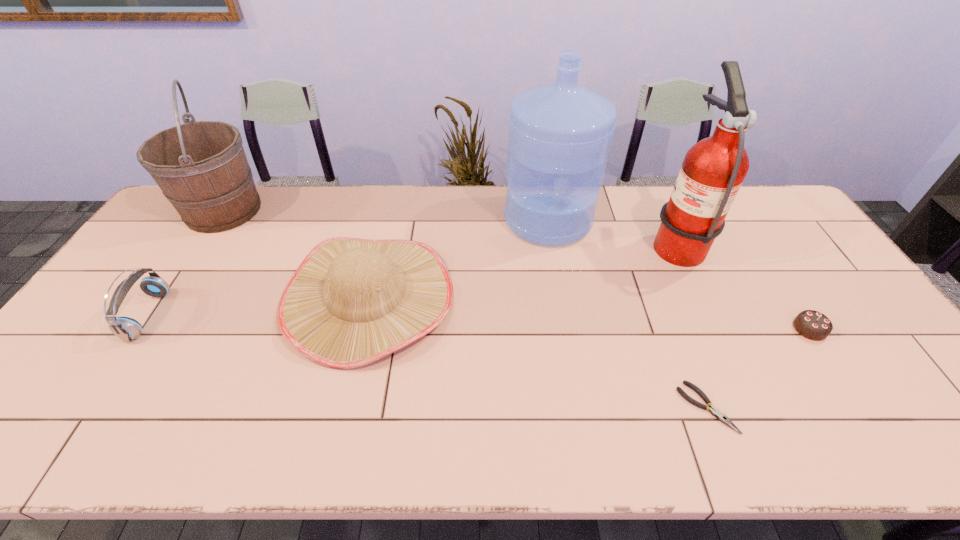
At what (x,y) coordinates should I click in order to perform the action: click on object that is the third closest to the fourth object from right to left. Please return your answer as a coordinate pair (x, y). Looking at the image, I should click on (719, 415).

Find the location of a particular element. free space that satisfies the following two spatial constraints: 1. on the side of the fourth object from left to right with the handle; 2. on the ear cups of the third shortest object is located at coordinates (564, 315).

The width and height of the screenshot is (960, 540). I want to click on free point that satisfies the following two spatial constraints: 1. on the back side of the sixth tallest object; 2. on the left side of the pliers, so click(x=676, y=329).

Where is `free space that satisfies the following two spatial constraints: 1. on the ear cups of the fifth tallest object; 2. on the back side of the shortest object`? free space that satisfies the following two spatial constraints: 1. on the ear cups of the fifth tallest object; 2. on the back side of the shortest object is located at coordinates (86, 407).

At what (x,y) coordinates should I click in order to perform the action: click on free spot that satisfies the following two spatial constraints: 1. on the front side of the sunhat; 2. on the left side of the fifth shortest object. Please return your answer as a coordinate pair (x, y). The height and width of the screenshot is (540, 960). Looking at the image, I should click on (167, 297).